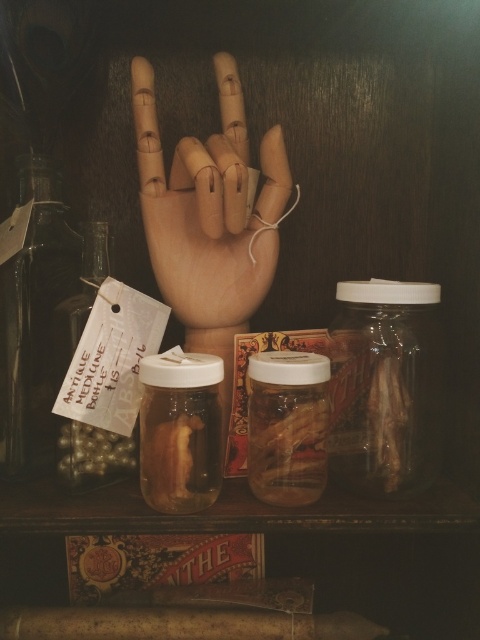
Who is lower down, translucent glass jar at right or shiny metallic beans at center left?

shiny metallic beans at center left

Between translucent glass jar at right and shiny metallic beans at center left, which one has less height?

shiny metallic beans at center left

Identify the location of translucent glass jar at right. The width and height of the screenshot is (480, 640). (387, 422).

At what (x,y) coordinates should I click in order to perform the action: click on translucent glass jar at right. Please return your answer as a coordinate pair (x, y). The width and height of the screenshot is (480, 640). Looking at the image, I should click on (387, 422).

How much distance is there between translucent glass jar at center and translucent gelatinous object at center?

translucent glass jar at center and translucent gelatinous object at center are 2.71 inches apart.

Does translucent glass jar at center have a lesser width compared to translucent gelatinous object at center?

No, translucent glass jar at center is not thinner than translucent gelatinous object at center.

Between point (288, 397) and point (167, 468), which one is positioned behind?

Positioned behind is point (288, 397).

What are the coordinates of `translucent glass jar at center` in the screenshot? It's located at (288, 426).

Is clear glass jar at center right wider than translucent glass jar at left?

Yes.

This screenshot has height=640, width=480. What are the coordinates of `clear glass jar at center right` in the screenshot? It's located at (385, 385).

Image resolution: width=480 pixels, height=640 pixels. I want to click on clear glass jar at center right, so click(385, 385).